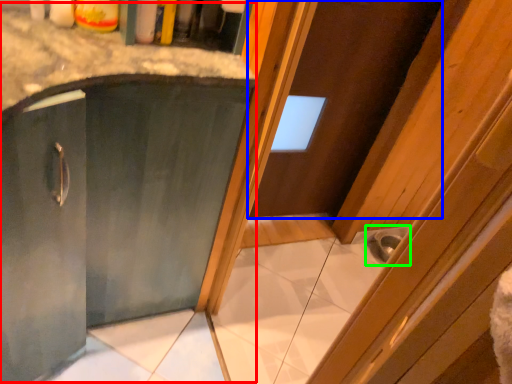
Question: Which is nearer to the cabinetry (highlighted by a red box)? door (highlighted by a blue box) or sink (highlighted by a green box).

Choices:
 (A) door
 (B) sink

Answer: (A)